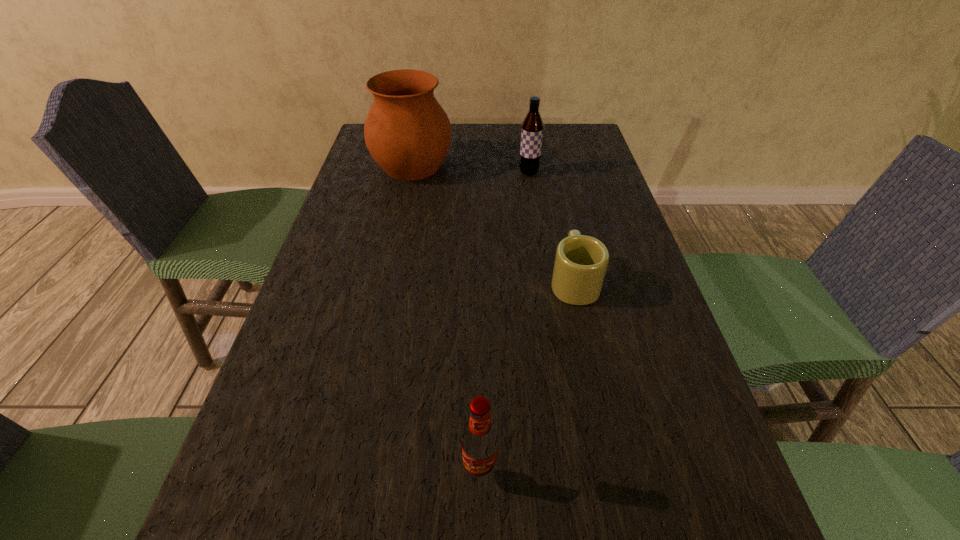
Where is `free area in between the third object from right to left and the shortest object`? The height and width of the screenshot is (540, 960). free area in between the third object from right to left and the shortest object is located at coordinates (527, 375).

This screenshot has height=540, width=960. What are the coordinates of `vacant area that lies between the second nearest object and the right root beer` in the screenshot? It's located at (551, 227).

Locate an element on the screen. This screenshot has width=960, height=540. vacant area that lies between the farther root beer and the nearest object is located at coordinates click(x=504, y=321).

This screenshot has height=540, width=960. What are the coordinates of `vacant space that is in between the pottery and the second nearest object` in the screenshot? It's located at (493, 224).

This screenshot has height=540, width=960. I want to click on unoccupied area between the third tallest object and the farther root beer, so click(504, 321).

Where is `free space between the third farthest object and the farther root beer`? This screenshot has height=540, width=960. free space between the third farthest object and the farther root beer is located at coordinates (551, 227).

The width and height of the screenshot is (960, 540). Identify the location of empty space between the shortest object and the right root beer. (551, 227).

The width and height of the screenshot is (960, 540). In order to click on free spot between the right root beer and the leftmost object in this screenshot , I will do pos(470,170).

Where is `empty space between the second nearest object and the pottery`? The image size is (960, 540). empty space between the second nearest object and the pottery is located at coordinates (493, 224).

You are a GUI agent. You are given a task and a screenshot of the screen. Output one action in this format:
    pyautogui.click(x=<x>, y=<y>)
    Task: Click on the free point between the right root beer and the leftmost object
    This screenshot has width=960, height=540.
    Given the screenshot: What is the action you would take?
    pyautogui.click(x=470, y=170)